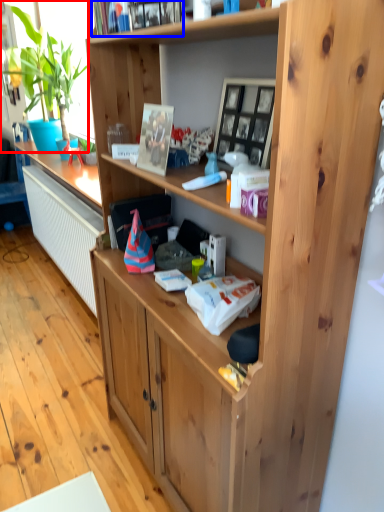
Question: Which point is closer to the camera, houseplant (highlighted by a red box) or book (highlighted by a blue box)?

Choices:
 (A) houseplant
 (B) book

Answer: (B)